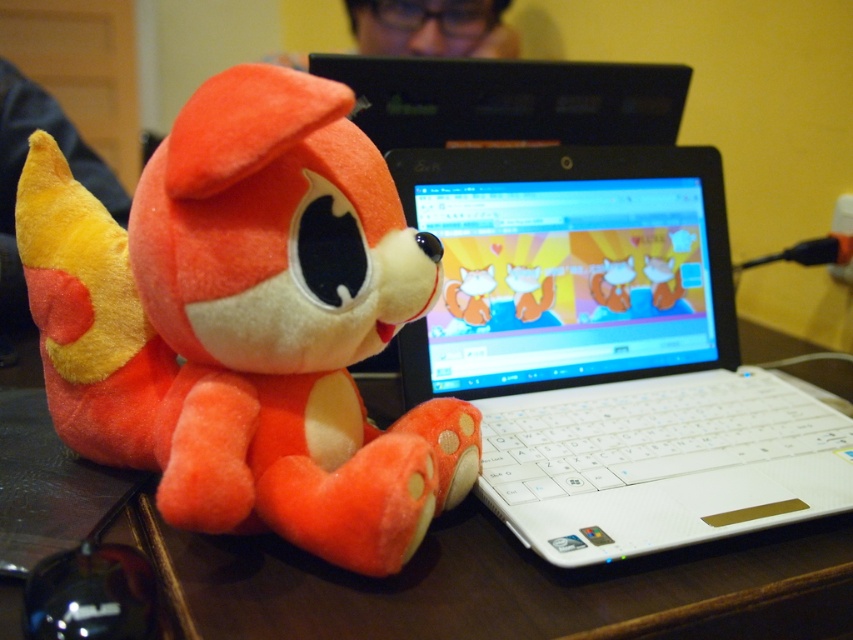
Question: Does fluffy orange plush toy at left appear over wooden table at lower left?

Choices:
 (A) no
 (B) yes

Answer: (B)

Question: Considering the real-world distances, which object is farthest from the wooden table at lower left?

Choices:
 (A) white plastic laptop at center
 (B) matte black laptop at upper center
 (C) fluffy orange plush toy at left

Answer: (B)

Question: Is fluffy orange plush toy at left closer to camera compared to matte black laptop at upper center?

Choices:
 (A) no
 (B) yes

Answer: (B)

Question: Can you confirm if fluffy orange plush toy at left is positioned to the left of wooden table at lower left?

Choices:
 (A) no
 (B) yes

Answer: (B)

Question: Which point is farther to the camera?

Choices:
 (A) (469, 502)
 (B) (302, 506)
 (C) (723, 259)

Answer: (C)

Question: Which object is the closest to the fluffy orange plush toy at left?

Choices:
 (A) matte black laptop at upper center
 (B) wooden table at lower left

Answer: (B)